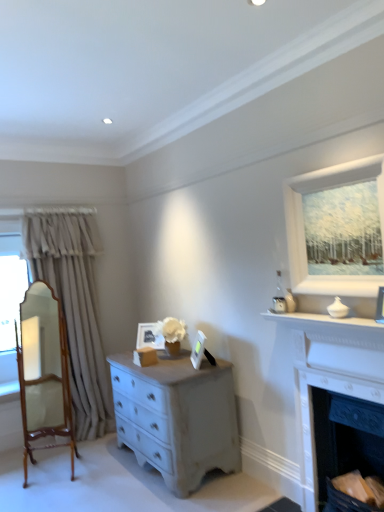
Question: Is dark gray stone fireplace at lower right, the 2th fireplace when ordered from top to bottom, taller or shorter than white matte picture frame at upper right, which is the third picture frame from bottom to top?

Choices:
 (A) short
 (B) tall

Answer: (B)

Question: Does point (327, 486) appear closer or farther from the camera than point (375, 309)?

Choices:
 (A) farther
 (B) closer

Answer: (A)

Question: Which object is positioned farthest from the matte white picture frame at center, which is the 1th picture frame in left-to-right order?

Choices:
 (A) wooden polished mirror at left
 (B) white painted wood at upper right
 (C) white glossy picture frame at center, acting as the 2th picture frame starting from the left
 (D) beige fabric curtain at left
 (E) white marble fireplace at right, the 2th fireplace in the bottom-to-top sequence

Answer: (B)

Question: Estimate the real-world distances between objects in this image. Which object is closer to the wooden polished mirror at left?

Choices:
 (A) white matte picture frame at upper right, which is counted as the 1th picture frame, starting from the front
 (B) matte white picture frame at center, acting as the first picture frame starting from the bottom
 (C) beige fabric curtain at left
 (D) white marble fireplace at right, which is counted as the first fireplace, starting from the top
 (E) dark gray stone fireplace at lower right, marked as the first fireplace in a bottom-to-top arrangement

Answer: (C)